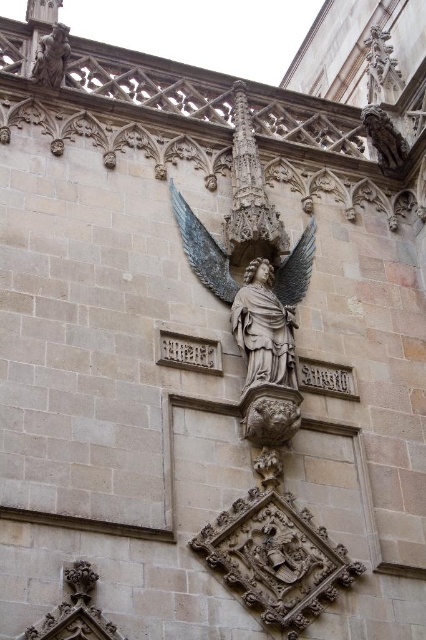
Question: Among these objects, which one is farthest from the camera?

Choices:
 (A) polished bronze wing at center
 (B) satin gold wings at center

Answer: (A)

Question: Does satin gold wings at center appear over polished bronze wing at center?

Choices:
 (A) no
 (B) yes

Answer: (B)

Question: Does polished stone angel at center appear over polished bronze wing at center?

Choices:
 (A) no
 (B) yes

Answer: (A)

Question: Among these objects, which one is farthest from the camera?

Choices:
 (A) matte stone angel at upper left
 (B) polished stone angel at center

Answer: (A)

Question: Does satin gold wings at center appear under matte stone angel at upper left?

Choices:
 (A) no
 (B) yes

Answer: (B)

Question: Among these objects, which one is nearest to the camera?

Choices:
 (A) matte stone angel at upper left
 (B) satin gold wings at center
 (C) polished stone angel at center

Answer: (C)